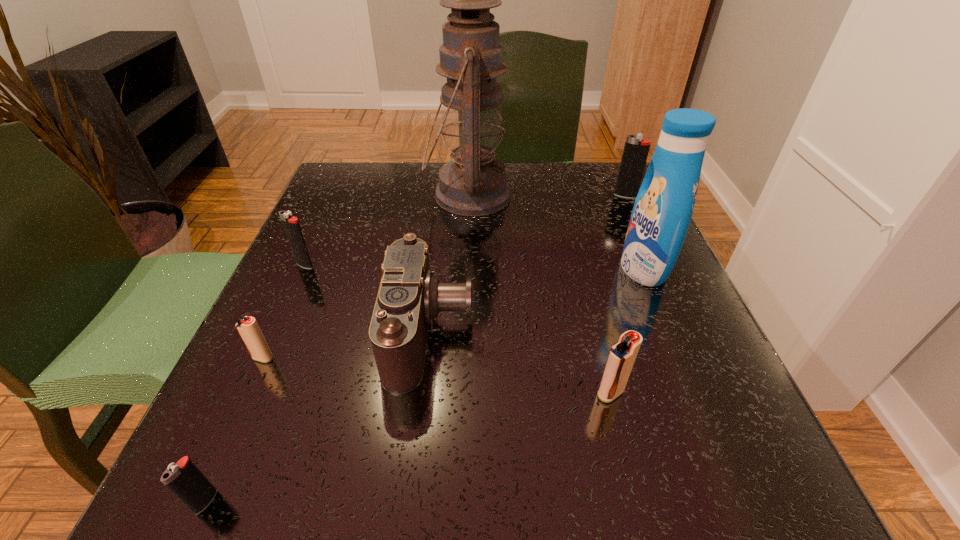
Where is `free region at the near edge of the desktop`? Image resolution: width=960 pixels, height=540 pixels. free region at the near edge of the desktop is located at coordinates (623, 506).

Locate an element on the screen. blank area at the left edge is located at coordinates (299, 330).

The height and width of the screenshot is (540, 960). In order to click on vacant space at the right edge of the desktop in this screenshot , I will do 628,316.

Locate an element on the screen. free region at the far left corner is located at coordinates (387, 198).

Where is `free location at the far right corner`? free location at the far right corner is located at coordinates tap(587, 202).

Where is `free space at the near right corner`? The height and width of the screenshot is (540, 960). free space at the near right corner is located at coordinates (689, 460).

Find the location of a particular element. free space between the camera and the third object from right to left is located at coordinates coord(520,362).

Locate an element on the screen. free area in between the second tallest object and the second farthest igniter is located at coordinates (474, 266).

I want to click on free space between the blue oil lamp and the right red igniter, so click(x=540, y=294).

You are a GUI agent. You are given a task and a screenshot of the screen. Output one action in this format:
    pyautogui.click(x=<x>, y=<y>)
    Task: Click on the free space between the left red igniter and the detergent
    The height and width of the screenshot is (540, 960).
    Given the screenshot: What is the action you would take?
    pyautogui.click(x=453, y=313)